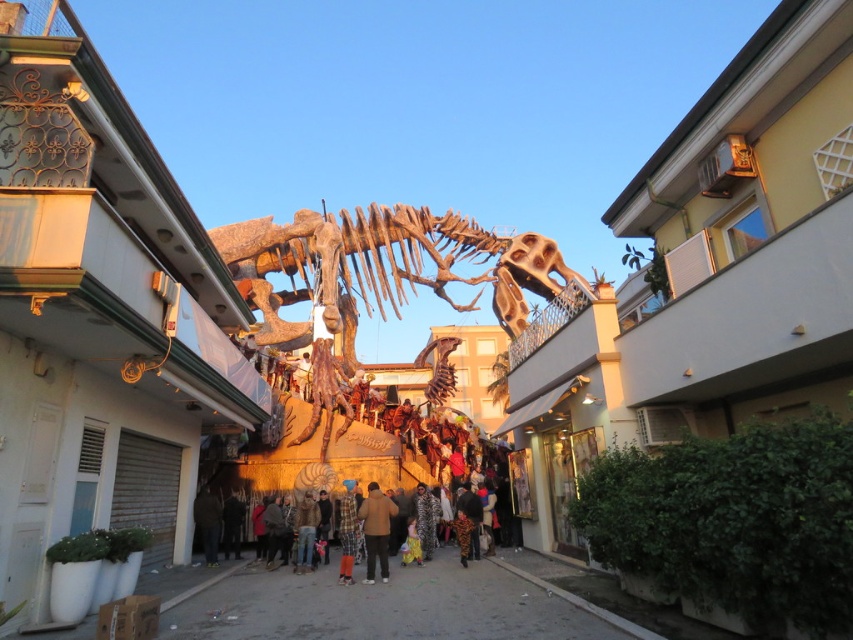
You are standing at the point marked as point (207, 522) in the image. Looking around, you see a dark brown fabric at lower center. Which direction should you face to see the dark brown fabric at lower center?

You should face towards the lower center direction to see the dark brown fabric at lower center, as the point (207, 522) is located on it.